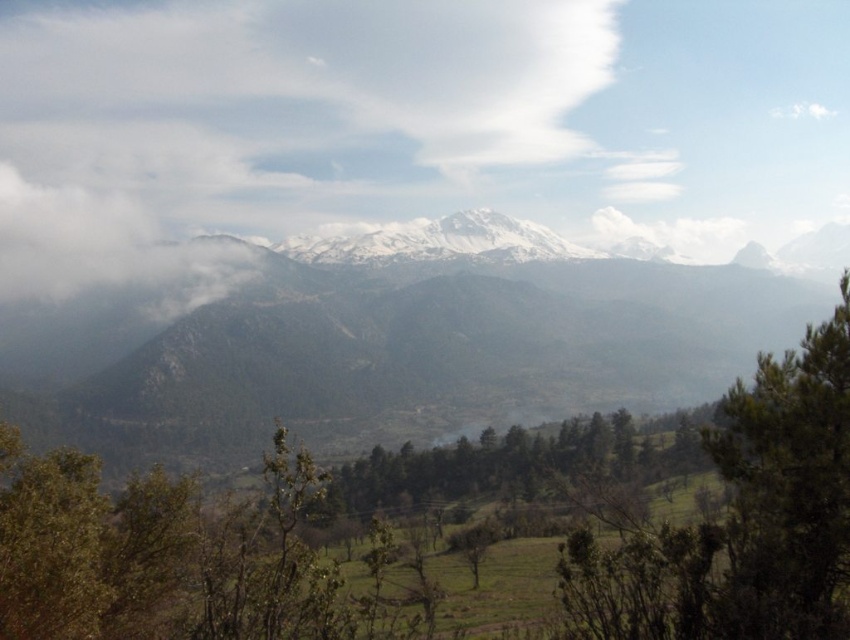
Question: Is white fluffy cloud at upper center below snowy rock mountain range at center?

Choices:
 (A) no
 (B) yes

Answer: (A)

Question: Estimate the real-world distances between objects in this image. Which object is closer to the snowy rock mountain range at center?

Choices:
 (A) green leafy tree at lower right
 (B) white fluffy cloud at upper center

Answer: (B)

Question: Can you confirm if white fluffy cloud at upper center is wider than green leafy tree at lower right?

Choices:
 (A) yes
 (B) no

Answer: (A)

Question: Which object appears farthest from the camera in this image?

Choices:
 (A) white fluffy cloud at upper center
 (B) snowy rock mountain range at center

Answer: (A)

Question: Is white fluffy cloud at upper center further to camera compared to snowy rock mountain range at center?

Choices:
 (A) no
 (B) yes

Answer: (B)

Question: Which point is farther to the camera?

Choices:
 (A) green leafy tree at lower right
 (B) snowy rock mountain range at center

Answer: (B)